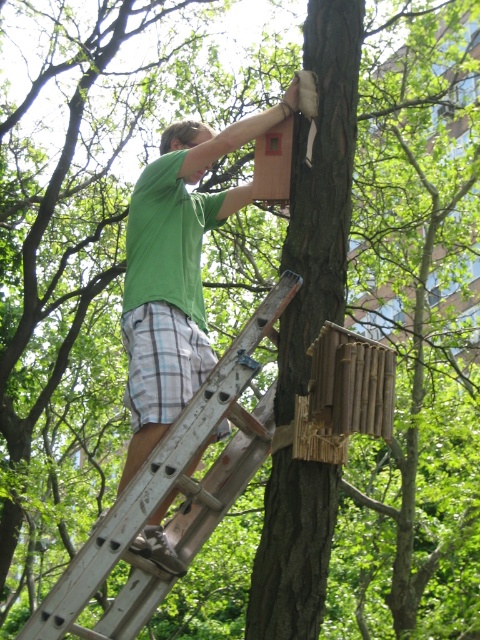
You are a painter who needs to reach the top of the wooden ladder at center to paint the wooden birdhouse at upper center. Considering the height of the ladder and the birdhouse, can you safely reach the birdhouse without needing to climb higher than the ladder allows?

The wooden ladder at center has a greater height compared to wooden birdhouse at upper center, so yes, you can safely reach the birdhouse without needing to climb higher than the ladder allows.

Please provide the coordinates of the green matte shirt at upper center in the image.

The green matte shirt at upper center is located at coordinates point (176, 272).

You are standing at the origin point of the image. Which direction should you move to reach the wooden ladder at center?

The wooden ladder at center is located at point (169, 488), so you should move towards the right and forward to reach it.